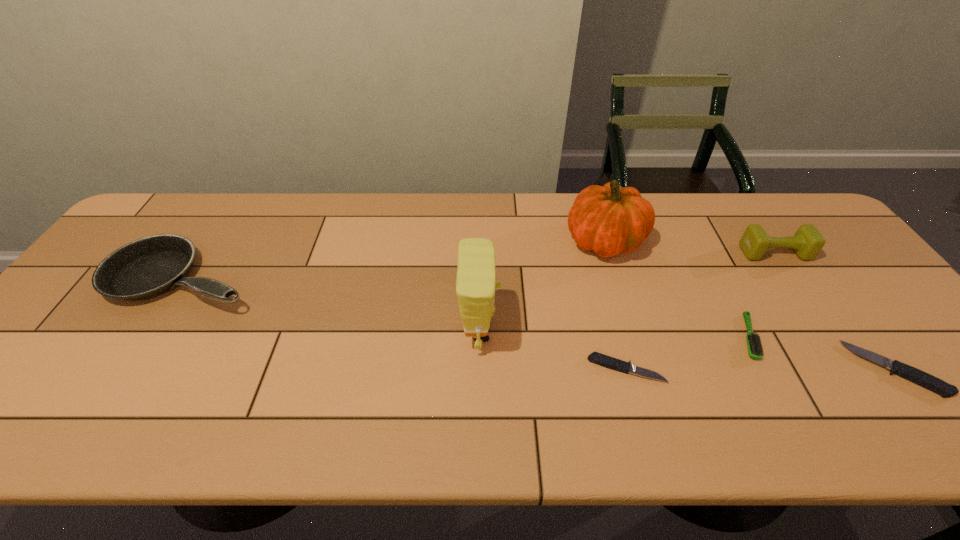
Considering the uniform spacing of steak knifes, where should an additional steak knife be positioned on the left? Please locate a free spot. Please provide its 2D coordinates. Your answer should be formatted as a tuple, i.e. [(x, y)], where the tuple contains the x and y coordinates of a point satisfying the conditions above.

[(358, 369)]